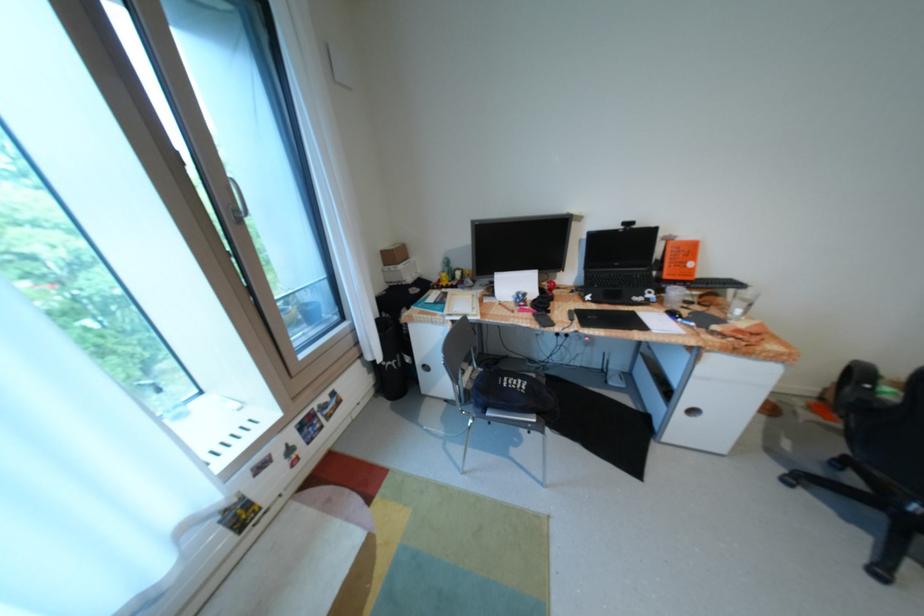
Where would you lift the orange book? Please return your answer as a coordinate pair (x, y).

(679, 259)